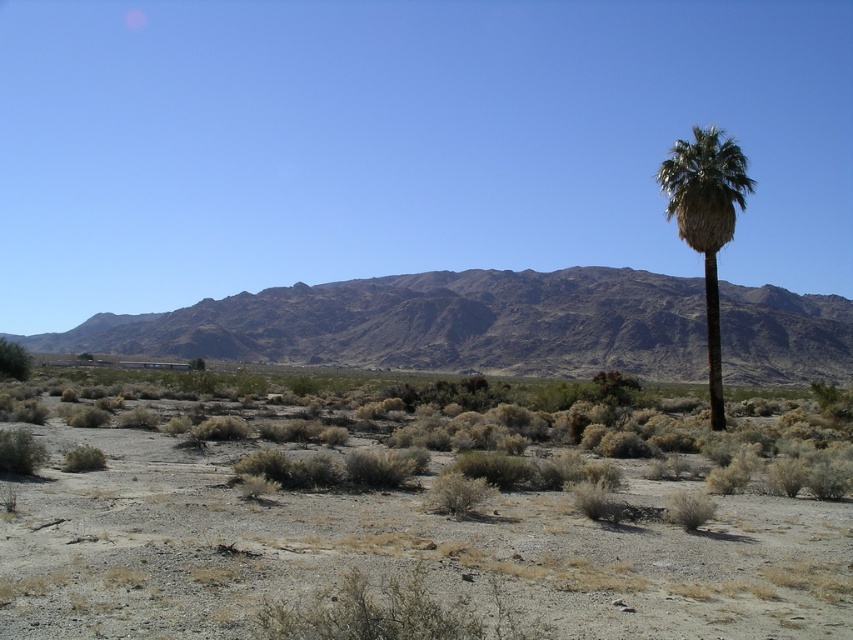
Question: Can you confirm if dry shrubbery at center is positioned to the right of green leafy palm at right?

Choices:
 (A) no
 (B) yes

Answer: (A)

Question: Can you confirm if dark brown rocky mountain range at center is bigger than green leafy bush at lower left?

Choices:
 (A) no
 (B) yes

Answer: (B)

Question: Which point is closer to the camera?

Choices:
 (A) green leafy bush at lower left
 (B) green leafy palm at right

Answer: (B)

Question: Observing the image, what is the correct spatial positioning of dark brown rocky mountain range at center in reference to green leafy palm at right?

Choices:
 (A) right
 (B) left

Answer: (B)

Question: Estimate the real-world distances between objects in this image. Which object is closer to the dry shrubbery at center?

Choices:
 (A) green leafy bush at lower left
 (B) green leafy palm at right
 (C) dark brown rocky mountain range at center

Answer: (B)

Question: Which is farther from the dark brown rocky mountain range at center?

Choices:
 (A) green leafy bush at lower left
 (B) green leafy palm at right
 (C) dry shrubbery at center

Answer: (A)